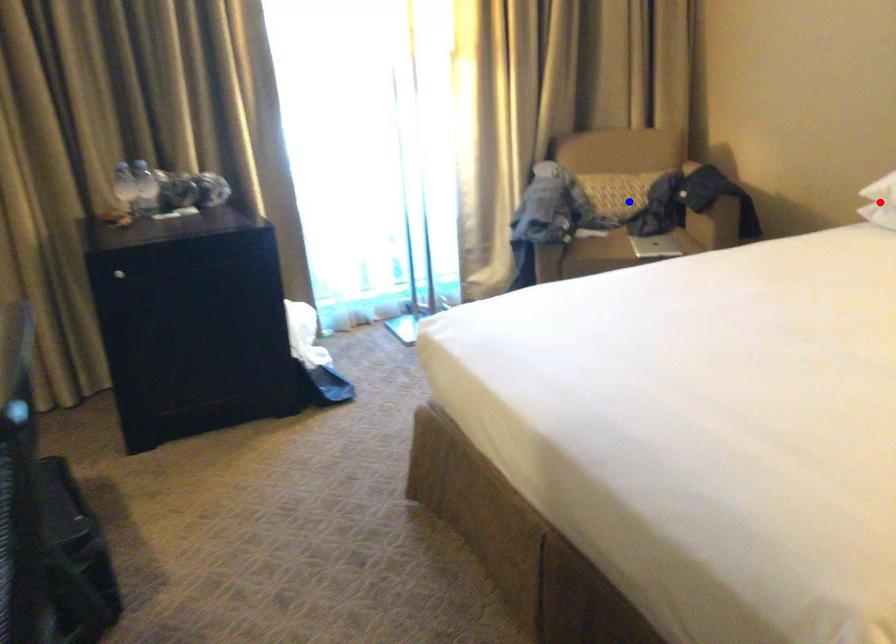
Question: In the image, two points are highlighted. Which point is nearer to the camera? Reply with the corresponding letter.

Choices:
 (A) blue point
 (B) red point

Answer: (B)